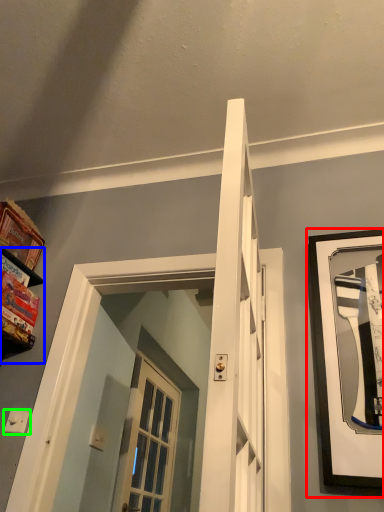
Question: Based on their relative distances, which object is nearer to picture frame (highlighted by a red box)? Choose from shelf (highlighted by a blue box) and light switch (highlighted by a green box).

Choices:
 (A) shelf
 (B) light switch

Answer: (B)